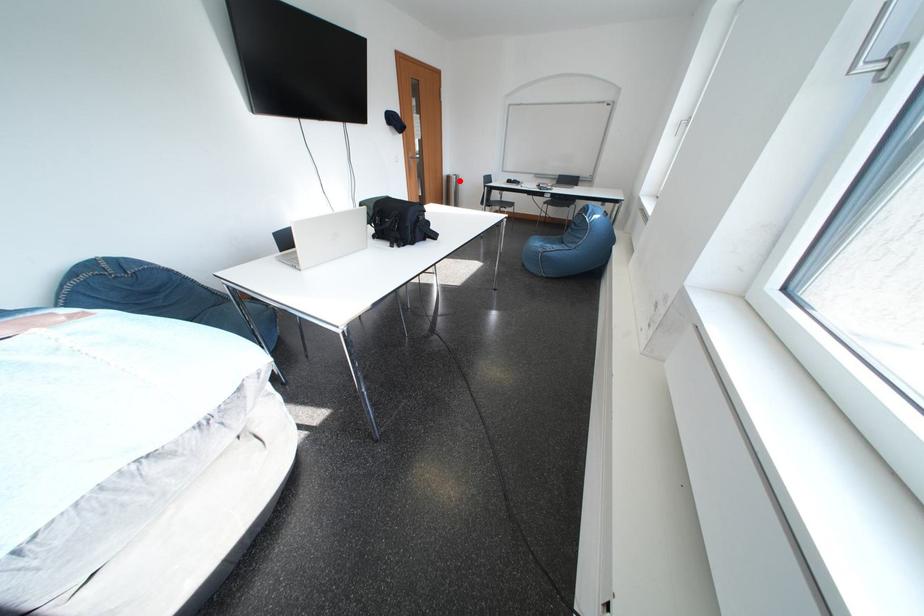
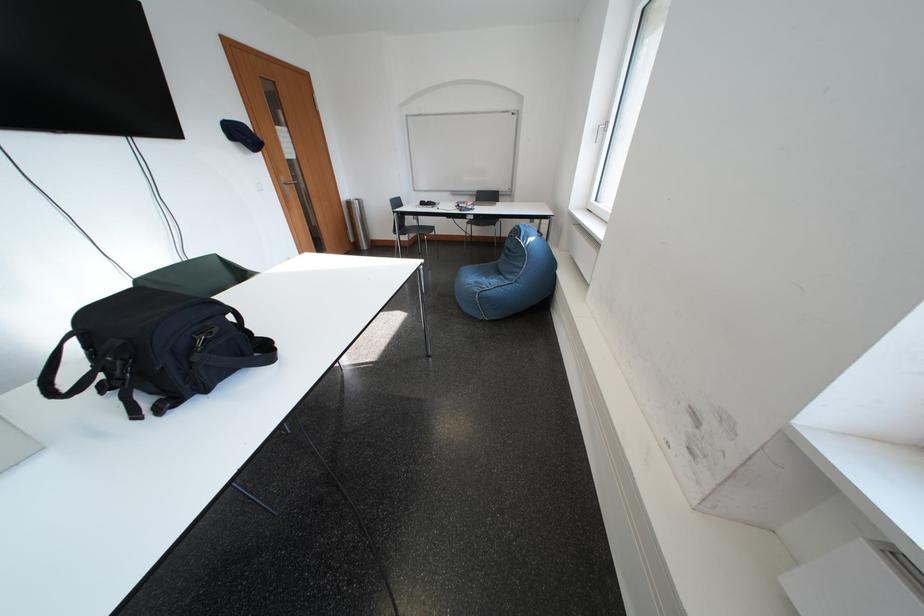
Where in the second image is the point corresponding to the highlighted location from the first image?

(360, 207)